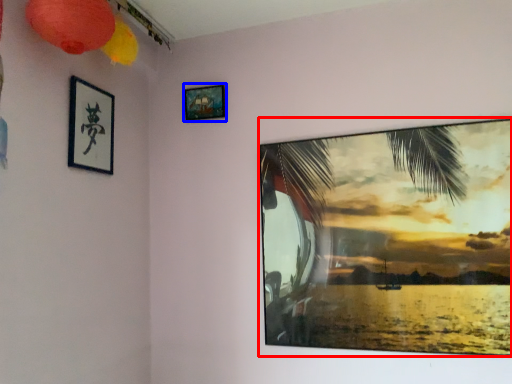
Question: Which of the following is the farthest to the observer, picture frame (highlighted by a red box) or picture frame (highlighted by a blue box)?

Choices:
 (A) picture frame
 (B) picture frame

Answer: (B)